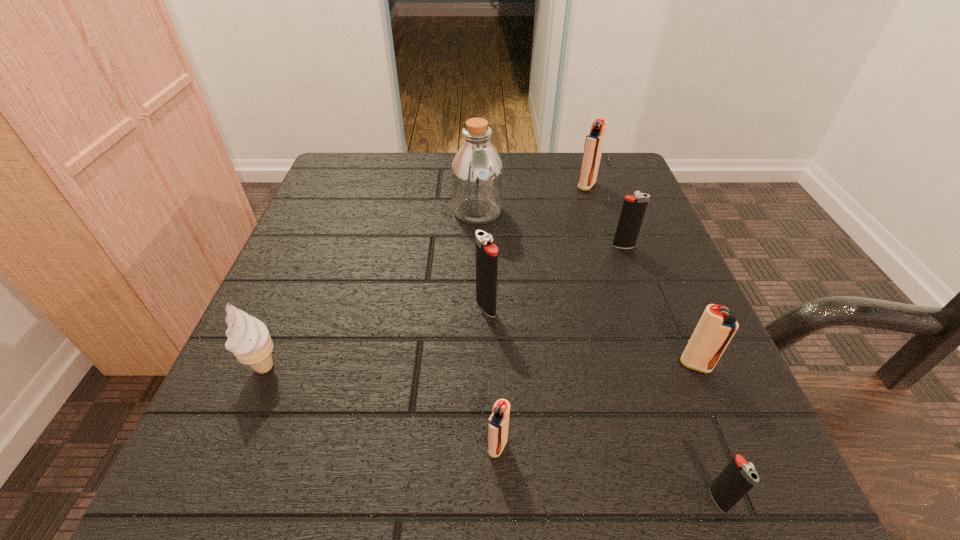
In order to click on bottle in this screenshot , I will do (477, 175).

Find the location of `the tallest object`. the tallest object is located at coordinates (477, 175).

At what (x,y) coordinates should I click in order to perform the action: click on the farthest igniter. Please return your answer as a coordinate pair (x, y). Looking at the image, I should click on (594, 141).

You are a GUI agent. You are given a task and a screenshot of the screen. Output one action in this format:
    pyautogui.click(x=<x>, y=<y>)
    Task: Click on the farthest red igniter
    This screenshot has width=960, height=540.
    Given the screenshot: What is the action you would take?
    pyautogui.click(x=594, y=141)

I want to click on the biggest black igniter, so click(486, 253).

Where is `the third farthest igniter`? the third farthest igniter is located at coordinates (486, 253).

This screenshot has width=960, height=540. I want to click on icecream, so click(249, 340).

Image resolution: width=960 pixels, height=540 pixels. Find the location of `the second biggest black igniter`. the second biggest black igniter is located at coordinates (633, 210).

Find the location of a particular element. The height and width of the screenshot is (540, 960). the farthest black igniter is located at coordinates (633, 210).

Locate an element on the screen. This screenshot has height=540, width=960. the second farthest red igniter is located at coordinates (715, 329).